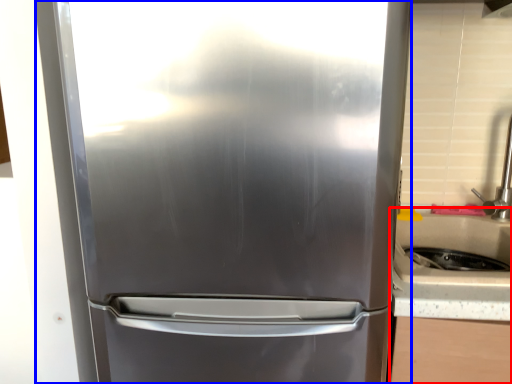
Question: Among these objects, which one is farthest to the camera, counter top (highlighted by a red box) or refrigerator (highlighted by a blue box)?

Choices:
 (A) counter top
 (B) refrigerator

Answer: (A)